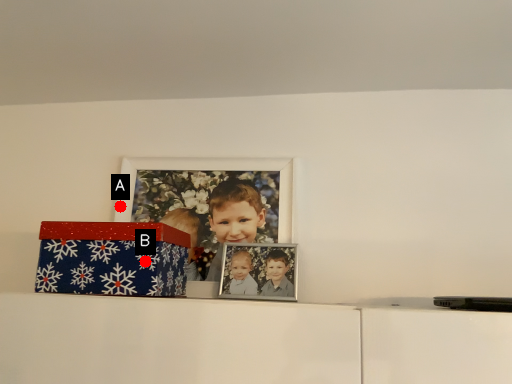
Question: Two points are circled on the image, labeled by A and B beside each circle. Which point is farther to the camera?

Choices:
 (A) A is further
 (B) B is further

Answer: (A)